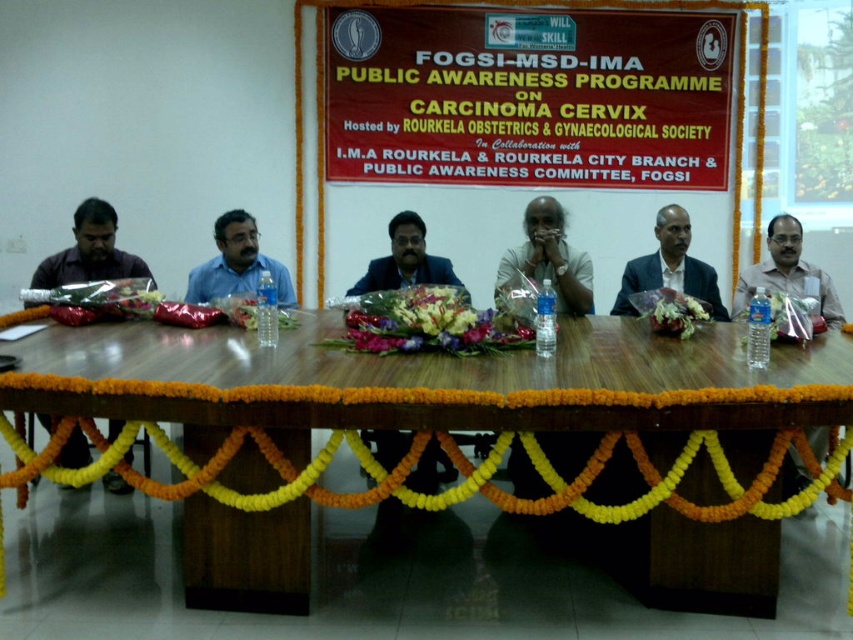
Question: Which point is closer to the camera taking this photo?

Choices:
 (A) (94, 413)
 (B) (659, 280)

Answer: (A)

Question: Can you confirm if wooden table at center is positioned to the right of matte white shirt at right?

Choices:
 (A) no
 (B) yes

Answer: (A)

Question: Is matte black shirt at left above matte black shirt at center?

Choices:
 (A) no
 (B) yes

Answer: (A)

Question: Can you confirm if dark blue suit at center is positioned below matte blue shirt at center?

Choices:
 (A) yes
 (B) no

Answer: (B)

Question: Estimate the real-world distances between objects in this image. Which object is closer to the wooden table at center?

Choices:
 (A) matte black shirt at left
 (B) matte black shirt at center
 (C) matte blue shirt at center

Answer: (B)

Question: Which point is closer to the camera taking this photo?

Choices:
 (A) (698, 292)
 (B) (567, 285)
 (C) (136, 260)
 (D) (260, 268)

Answer: (B)